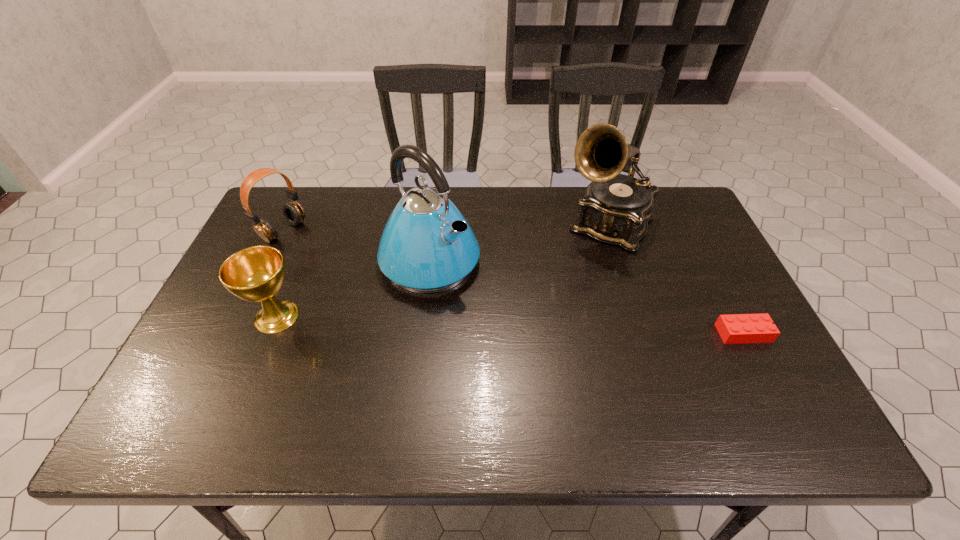
Where is `chalice`? chalice is located at coordinates (256, 274).

Find the location of a particular element. This screenshot has width=960, height=540. Lego is located at coordinates click(736, 328).

Identify the location of the shortest object. (736, 328).

Identify the location of the third object from left to right. Image resolution: width=960 pixels, height=540 pixels. (427, 246).

Locate an element on the screen. Image resolution: width=960 pixels, height=540 pixels. headset is located at coordinates point(293,212).

Locate an element on the screen. The width and height of the screenshot is (960, 540). phonograph record is located at coordinates (616, 208).

Where is `vacant space located on the back of the chalice`? This screenshot has width=960, height=540. vacant space located on the back of the chalice is located at coordinates (304, 248).

The height and width of the screenshot is (540, 960). In order to click on vacant space located 0.130m on the front of the rightmost object in this screenshot , I will do `click(774, 393)`.

What are the coordinates of `vacant space located 0.200m at the spout of the kettle` in the screenshot? It's located at tap(523, 327).

The width and height of the screenshot is (960, 540). I want to click on free space located at the spout of the kettle, so click(x=566, y=357).